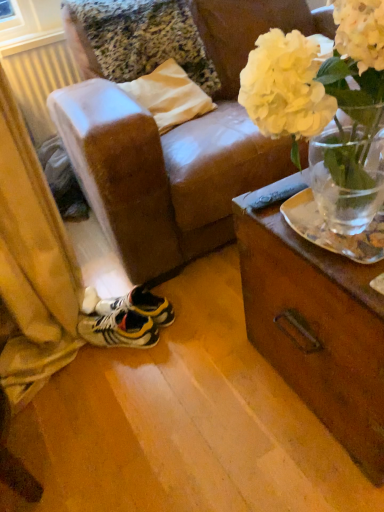
This screenshot has width=384, height=512. Describe the element at coordinates (125, 319) in the screenshot. I see `yellow and black synthetic sneakers at lower left` at that location.

Describe the element at coordinates (323, 102) in the screenshot. The image size is (384, 512). I see `white matte vase at upper right` at that location.

Locate an element on the screen. Image resolution: width=384 pixels, height=512 pixels. white matte vase at upper right is located at coordinates (323, 102).

What is the approximate height of white plastic radiator at left?

white plastic radiator at left is 16.88 inches tall.

Locate an element on the screen. This screenshot has height=512, width=384. yellow and black synthetic sneakers at lower left is located at coordinates (125, 319).

Considering the positions of objects white plastic radiator at left and white matte vase at upper right in the image provided, who is more to the left, white plastic radiator at left or white matte vase at upper right?

white plastic radiator at left is more to the left.

Which of these two, white plastic radiator at left or white matte vase at upper right, is wider?

With larger width is white matte vase at upper right.

Could you tell me if white plastic radiator at left is facing white matte vase at upper right?

Yes, white plastic radiator at left is aimed at white matte vase at upper right.

Is white plastic radiator at left taller than white matte vase at upper right?

In fact, white plastic radiator at left may be shorter than white matte vase at upper right.

In terms of height, does white plastic radiator at left look taller or shorter compared to yellow and black synthetic sneakers at lower left?

white plastic radiator at left is taller than yellow and black synthetic sneakers at lower left.

How many degrees apart are the facing directions of white plastic radiator at left and yellow and black synthetic sneakers at lower left?

The angle between the facing direction of white plastic radiator at left and the facing direction of yellow and black synthetic sneakers at lower left is 41.6 degrees.

Is white plastic radiator at left further to camera compared to yellow and black synthetic sneakers at lower left?

That is True.

Which is closer to the camera, (68, 50) or (95, 317)?

The point (95, 317) is more forward.

Does point (294, 34) lie behind point (23, 110)?

No, it is not.

From a real-world perspective, which is physically above, white matte vase at upper right or white plastic radiator at left?

In real-world perspective, white matte vase at upper right is above.

Find the location of a particular element. radiator that is on the left side of white matte vase at upper right is located at coordinates (39, 79).

Is white matte vase at upper right in front of white plastic radiator at left?

Yes, white matte vase at upper right is closer to the viewer.

Is yellow and black synthetic sneakers at lower left not within white plastic radiator at left?

Indeed, yellow and black synthetic sneakers at lower left is completely outside white plastic radiator at left.

Does yellow and black synthetic sneakers at lower left have a lesser height compared to white plastic radiator at left?

Yes.

From the image's perspective, which one is positioned lower, yellow and black synthetic sneakers at lower left or white plastic radiator at left?

yellow and black synthetic sneakers at lower left.

Is there a large distance between yellow and black synthetic sneakers at lower left and white plastic radiator at left?

Indeed, yellow and black synthetic sneakers at lower left is not near white plastic radiator at left.

Considering the points (144, 306) and (343, 20), which point is in front, point (144, 306) or point (343, 20)?

The point (343, 20) is closer to the camera.

Is yellow and black synthetic sneakers at lower left not within white matte vase at upper right?

Yes, yellow and black synthetic sneakers at lower left is not within white matte vase at upper right.

From the image's perspective, which object appears higher, yellow and black synthetic sneakers at lower left or white matte vase at upper right?

white matte vase at upper right appears higher in the image.

From the picture: Does yellow and black synthetic sneakers at lower left have a greater width compared to white matte vase at upper right?

No.

Is white matte vase at upper right facing away from yellow and black synthetic sneakers at lower left?

No, white matte vase at upper right is not facing the opposite direction of yellow and black synthetic sneakers at lower left.

From the image's perspective, which one is positioned lower, white matte vase at upper right or yellow and black synthetic sneakers at lower left?

yellow and black synthetic sneakers at lower left appears lower in the image.

What's the angular difference between white matte vase at upper right and yellow and black synthetic sneakers at lower left's facing directions?

44.4 degrees separate the facing orientations of white matte vase at upper right and yellow and black synthetic sneakers at lower left.

How distant is white matte vase at upper right from yellow and black synthetic sneakers at lower left?

white matte vase at upper right and yellow and black synthetic sneakers at lower left are 30.44 inches apart.

Where is `radiator below the white matte vase at upper right (from a real-world perspective)`? The image size is (384, 512). radiator below the white matte vase at upper right (from a real-world perspective) is located at coordinates (39, 79).

Find the location of a particular element. The width and height of the screenshot is (384, 512). radiator above the yellow and black synthetic sneakers at lower left (from the image's perspective) is located at coordinates (39, 79).

Looking at the image, which one is located further to white matte vase at upper right, white plastic radiator at left or yellow and black synthetic sneakers at lower left?

Among the two, white plastic radiator at left is located further to white matte vase at upper right.

Looking at the image, which one is located further to white plastic radiator at left, yellow and black synthetic sneakers at lower left or white matte vase at upper right?

white matte vase at upper right lies further to white plastic radiator at left than the other object.

When comparing their distances from yellow and black synthetic sneakers at lower left, does white matte vase at upper right or white plastic radiator at left seem closer?

Among the two, white matte vase at upper right is located nearer to yellow and black synthetic sneakers at lower left.

Which object lies further to the anchor point white plastic radiator at left, white matte vase at upper right or yellow and black synthetic sneakers at lower left?

Based on the image, white matte vase at upper right appears to be further to white plastic radiator at left.

When comparing their distances from white matte vase at upper right, does yellow and black synthetic sneakers at lower left or white plastic radiator at left seem closer?

yellow and black synthetic sneakers at lower left.

Looking at the image, which one is located closer to yellow and black synthetic sneakers at lower left, white plastic radiator at left or white matte vase at upper right?

white matte vase at upper right lies closer to yellow and black synthetic sneakers at lower left than the other object.

Find the location of a particular element. The image size is (384, 512). footwear positioned between white matte vase at upper right and white plastic radiator at left from near to far is located at coordinates (125, 319).